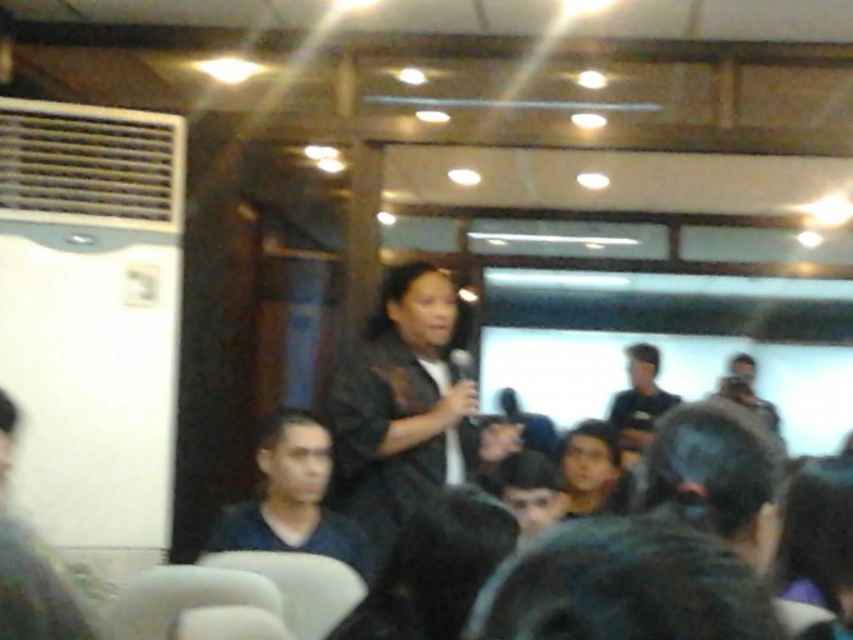
Is black matte dress at center wider than smooth black hair at center?

Correct, the width of black matte dress at center exceeds that of smooth black hair at center.

Is point (393, 396) positioned in front of point (579, 440)?

Yes.

Which is behind, point (370, 496) or point (576, 474)?

Point (576, 474)

I want to click on black matte dress at center, so click(405, 404).

Is dark blue shirt at lower left wider than dark gray shirt at center?

Answer: No.

What do you see at coordinates (291, 499) in the screenshot? This screenshot has height=640, width=853. I see `dark blue shirt at lower left` at bounding box center [291, 499].

The image size is (853, 640). What are the coordinates of `dark blue shirt at lower left` in the screenshot? It's located at (291, 499).

Who is shorter, black matte dress at center or dark blue shirt at lower left?

dark blue shirt at lower left

Does black matte dress at center appear on the left side of dark blue shirt at lower left?

No, black matte dress at center is not to the left of dark blue shirt at lower left.

Does point (462, 454) lie in front of point (244, 536)?

That is False.

Locate an element on the screen. The image size is (853, 640). black matte dress at center is located at coordinates coord(405,404).